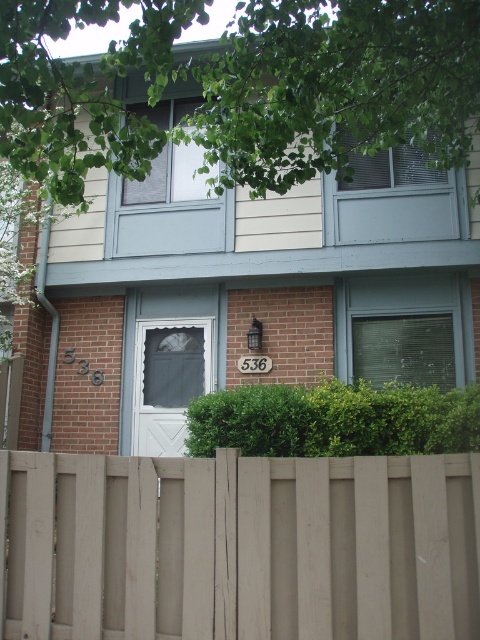
Question: Does light brown wooden fence at lower center have a greater width compared to green leafy hedge at center?

Choices:
 (A) yes
 (B) no

Answer: (B)

Question: Does light brown wooden fence at lower center have a lesser width compared to white mesh screen door at center?

Choices:
 (A) no
 (B) yes

Answer: (A)

Question: Which object is farther from the camera taking this photo?

Choices:
 (A) white mesh screen door at center
 (B) light brown wooden fence at lower center
 (C) green leafy hedge at center

Answer: (A)

Question: In this image, where is light brown wooden fence at lower center located relative to green leafy hedge at center?

Choices:
 (A) left
 (B) right

Answer: (A)

Question: Which of the following is the closest to the observer?

Choices:
 (A) (276, 557)
 (B) (468, 445)
 (C) (158, 352)

Answer: (A)

Question: Which of the following is the closest to the observer?

Choices:
 (A) (261, 396)
 (B) (371, 570)

Answer: (B)